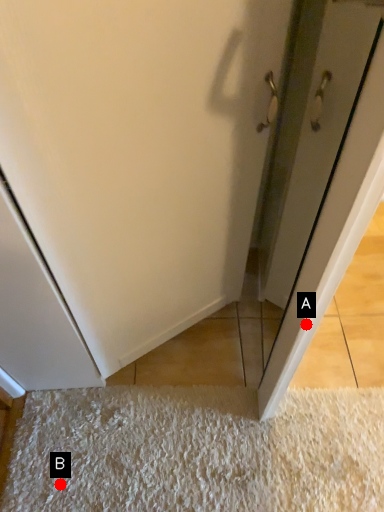
Question: Two points are circled on the image, labeled by A and B beside each circle. Which point is further to the camera?

Choices:
 (A) A is further
 (B) B is further

Answer: (B)